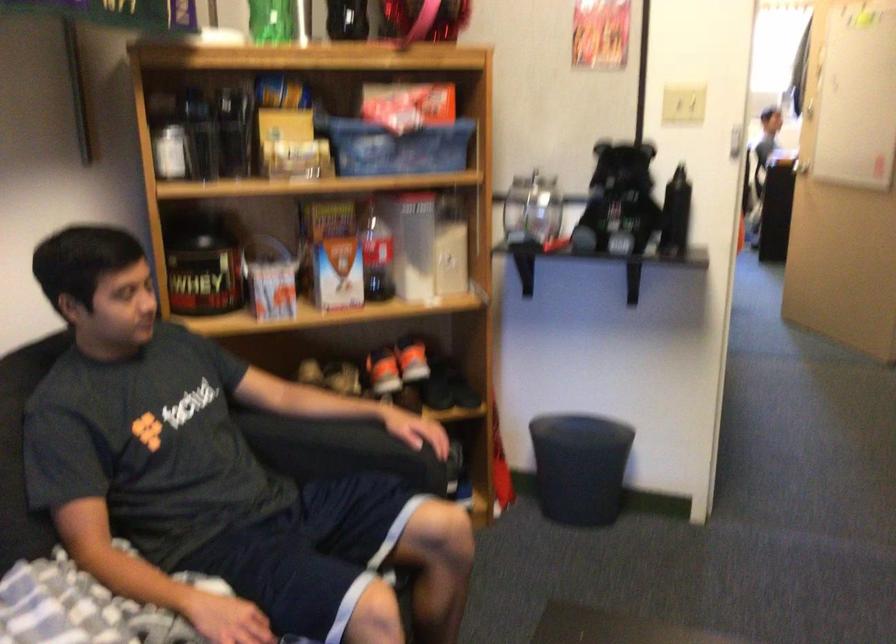
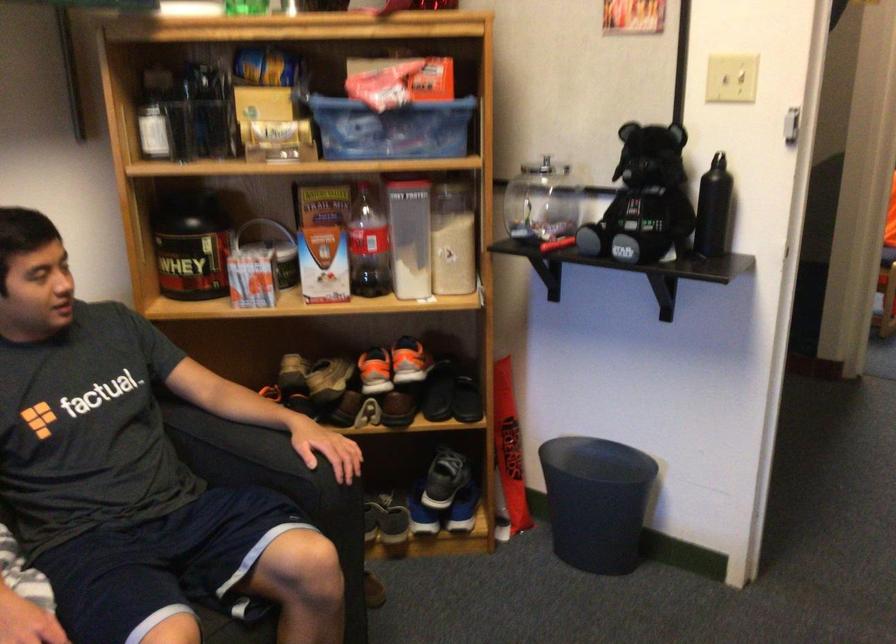
Locate, in the second image, the point that corresponds to point (576, 433) in the first image.

(597, 460)